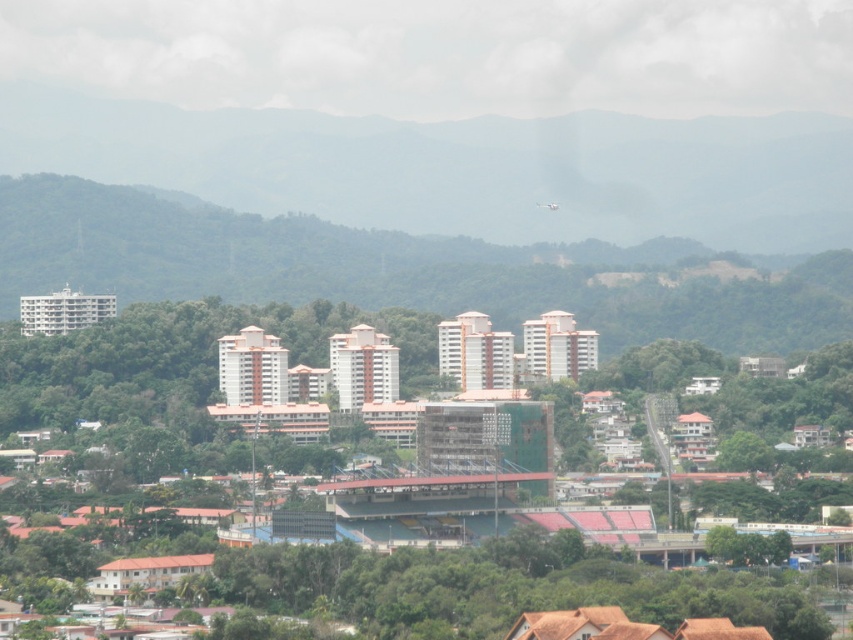
Question: Which object is the farthest from the green leafy tree at lower right?

Choices:
 (A) green leafy forest at upper center
 (B) green leafy forest at center

Answer: (A)

Question: Which point is closer to the camera?

Choices:
 (A) (776, 547)
 (B) (784, 129)
 (C) (409, 266)
 (D) (553, 204)

Answer: (C)

Question: Does green leafy forest at upper center appear under white matte airplane at upper center?

Choices:
 (A) yes
 (B) no

Answer: (B)

Question: Considering the real-world distances, which object is closest to the green leafy tree at lower right?

Choices:
 (A) green leafy forest at center
 (B) green leafy forest at upper center
 (C) white matte airplane at upper center

Answer: (A)

Question: Does green leafy forest at center have a lesser width compared to green leafy tree at lower right?

Choices:
 (A) no
 (B) yes

Answer: (A)

Question: Is green leafy forest at upper center positioned in front of green leafy tree at lower right?

Choices:
 (A) yes
 (B) no

Answer: (A)